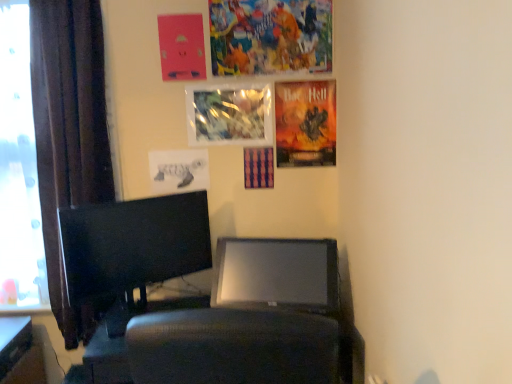
Question: Would you say dark brown fabric curtain at left is inside or outside black glossy monitor at left?

Choices:
 (A) outside
 (B) inside

Answer: (A)

Question: Is point (101, 135) closer or farther from the camera than point (103, 238)?

Choices:
 (A) farther
 (B) closer

Answer: (A)

Question: Estimate the real-world distances between objects in this image. Which object is closer to the white matte poster at center, the fifth poster page in the top-to-bottom sequence?

Choices:
 (A) colorful collage at upper center, placed as the first poster page when sorted from top to bottom
 (B) metallic reflective poster at upper center, which is counted as the 3th poster page, starting from the bottom
 (C) transparent glass window at left
 (D) black glossy monitor at left
 (E) matte pink poster at upper center, which appears as the 2th poster page when viewed from the top

Answer: (B)

Question: Which object is positioned closest to the matte black desk at lower left?

Choices:
 (A) white matte poster at center, the fifth poster page in the top-to-bottom sequence
 (B) transparent glass window at left
 (C) matte pink poster at upper center, which appears as the 2th poster page when viewed from the top
 (D) colorful collage at upper center, placed as the first poster page when sorted from top to bottom
 (E) orange matte poster at upper right, acting as the 4th poster page starting from the top

Answer: (B)